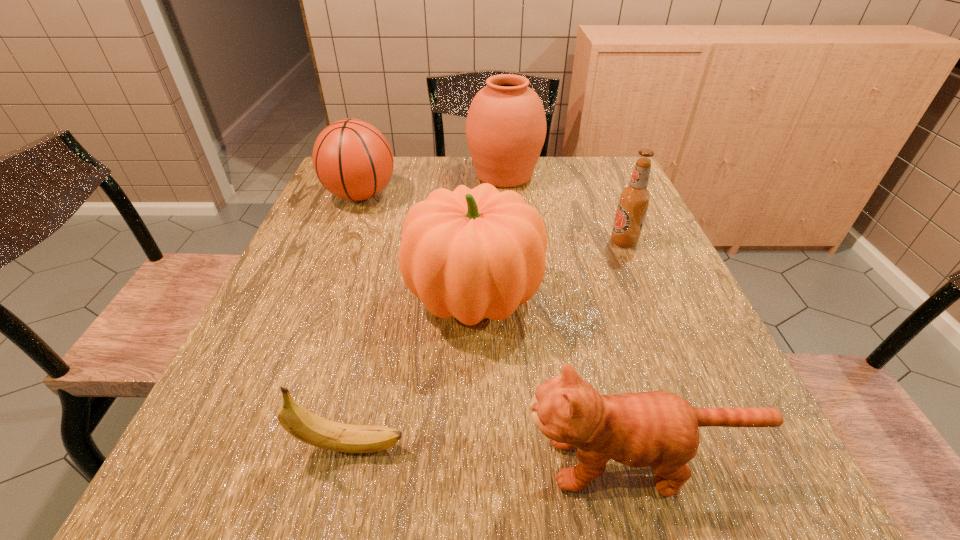
Find the location of `vacant region that satisfies the following two spatial constraints: 1. on the back side of the urn; 2. on the right side of the third nearest object`. vacant region that satisfies the following two spatial constraints: 1. on the back side of the urn; 2. on the right side of the third nearest object is located at coordinates (476, 175).